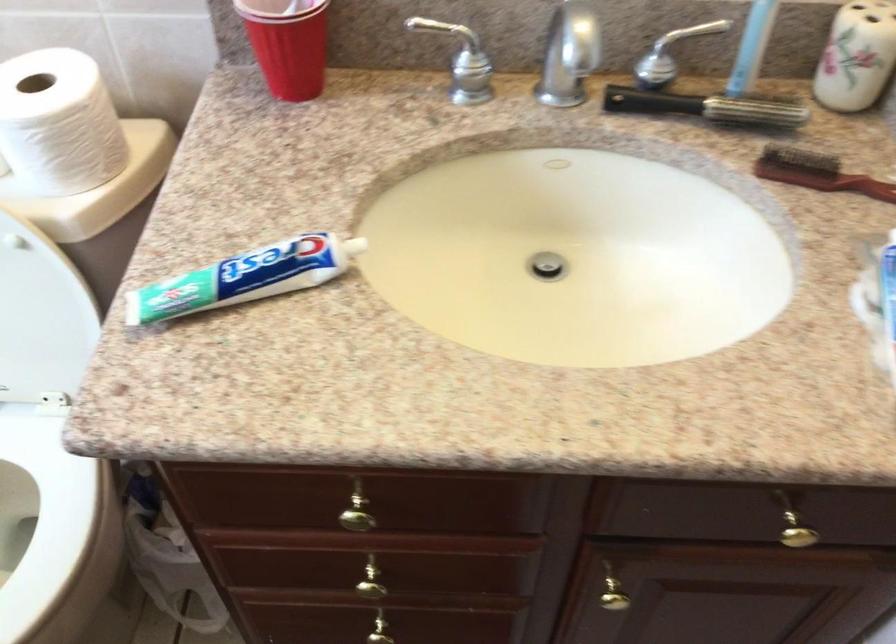
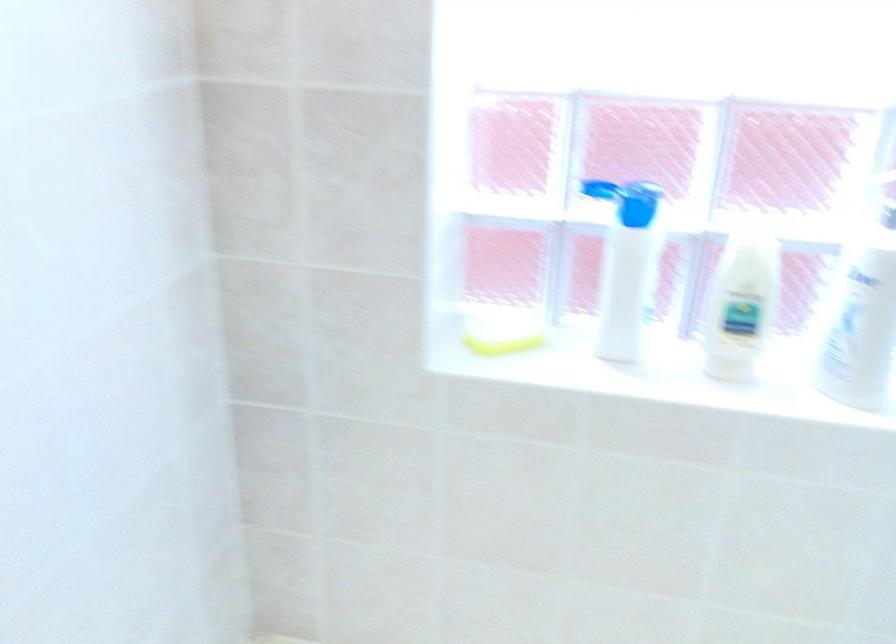
The images are taken continuously from a first-person perspective. In which direction is your viewpoint rotating?

The camera's rotation is toward left-down.